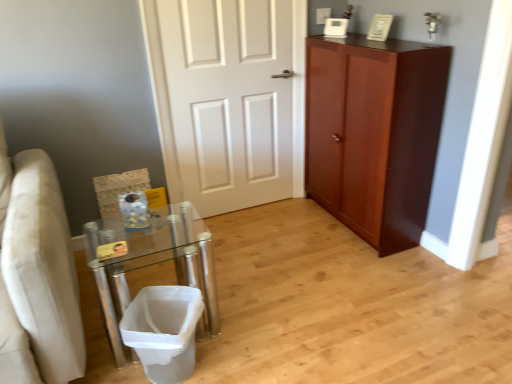
Question: Does clear glass table at lower left come behind white mesh laundry basket at lower left?

Choices:
 (A) no
 (B) yes

Answer: (B)

Question: Does clear glass table at lower left appear on the left side of white mesh laundry basket at lower left?

Choices:
 (A) no
 (B) yes

Answer: (B)

Question: Does clear glass table at lower left lie in front of white mesh laundry basket at lower left?

Choices:
 (A) yes
 (B) no

Answer: (B)

Question: Considering the relative sizes of clear glass table at lower left and white mesh laundry basket at lower left in the image provided, is clear glass table at lower left taller than white mesh laundry basket at lower left?

Choices:
 (A) yes
 (B) no

Answer: (A)

Question: Is clear glass table at lower left wider than white mesh laundry basket at lower left?

Choices:
 (A) yes
 (B) no

Answer: (A)

Question: Considering the relative sizes of clear glass table at lower left and white mesh laundry basket at lower left in the image provided, is clear glass table at lower left bigger than white mesh laundry basket at lower left?

Choices:
 (A) no
 (B) yes

Answer: (B)

Question: Can you confirm if white mesh laundry basket at lower left is shorter than white painted wood door at center?

Choices:
 (A) no
 (B) yes

Answer: (B)

Question: Could you tell me if white mesh laundry basket at lower left is turned towards white painted wood door at center?

Choices:
 (A) yes
 (B) no

Answer: (B)

Question: Is white mesh laundry basket at lower left to the left of white painted wood door at center from the viewer's perspective?

Choices:
 (A) yes
 (B) no

Answer: (A)

Question: Is white mesh laundry basket at lower left far away from white painted wood door at center?

Choices:
 (A) no
 (B) yes

Answer: (B)

Question: Is white mesh laundry basket at lower left behind white painted wood door at center?

Choices:
 (A) yes
 (B) no

Answer: (B)

Question: Is white mesh laundry basket at lower left turned away from white painted wood door at center?

Choices:
 (A) no
 (B) yes

Answer: (B)

Question: Can white mesh laundry basket at lower left be found inside white painted wood door at center?

Choices:
 (A) yes
 (B) no

Answer: (B)